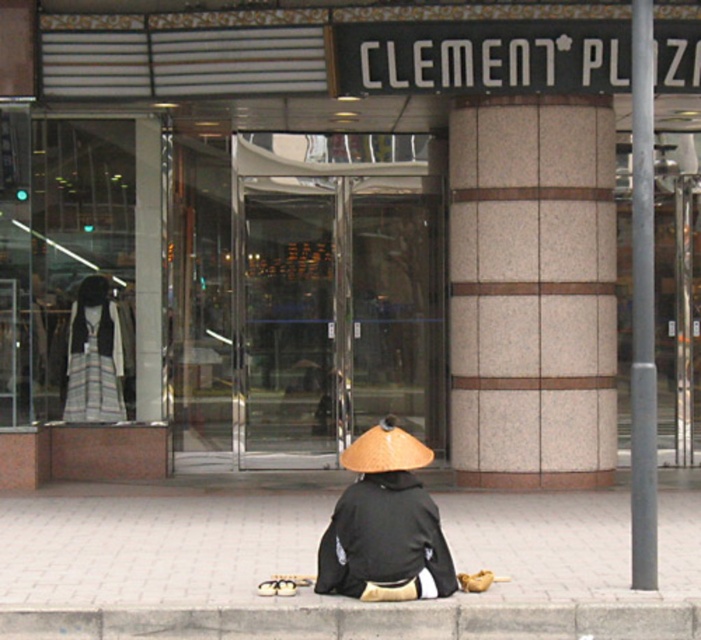
You are standing in front of the CLEMENT PLAZA entrance and see the black matte kimono at center. If you want to approach it without moving your feet, can you reach it with your outstretched hand?

The black matte kimono at center is 6.64 meters away from you, which is much farther than the typical human arm length. Therefore, you cannot reach it with your outstretched hand.

You are a delivery person who needs to park your 1.8 meters wide delivery cart between the beige stone pillar at center and the gray concrete curb at lower center. Can you fit your cart there based on the space available?

The beige stone pillar at center is taller than the gray concrete curb at lower center, but the description does not provide information about the horizontal space between them. Therefore, it is unclear if the cart can fit there.